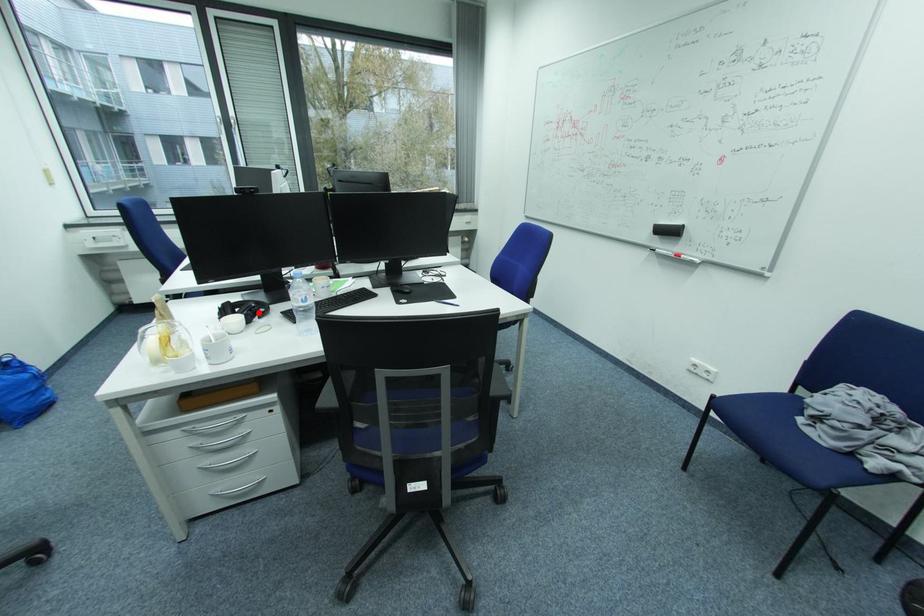
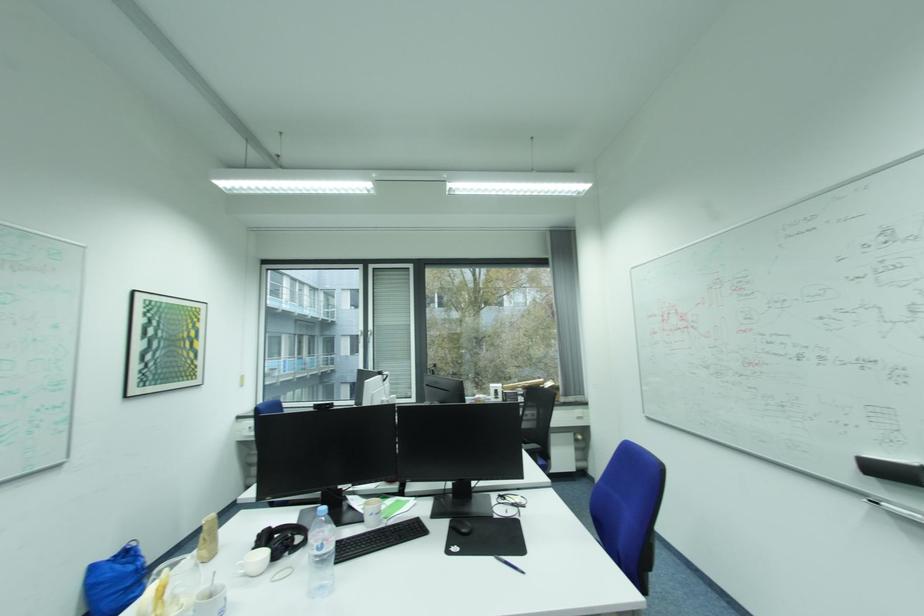
The point at the highlighted location is marked in the first image. Where is the corresponding point in the second image?

(287, 546)